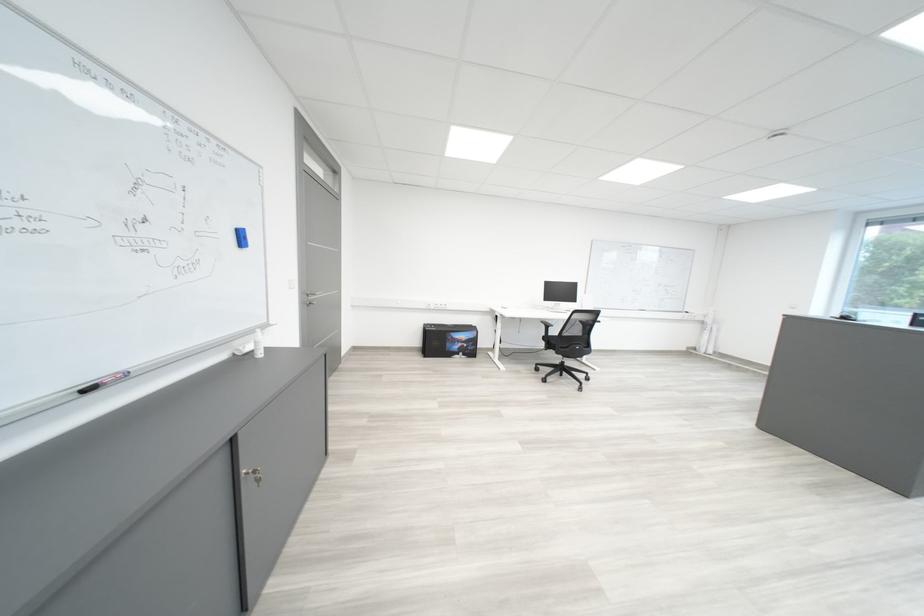
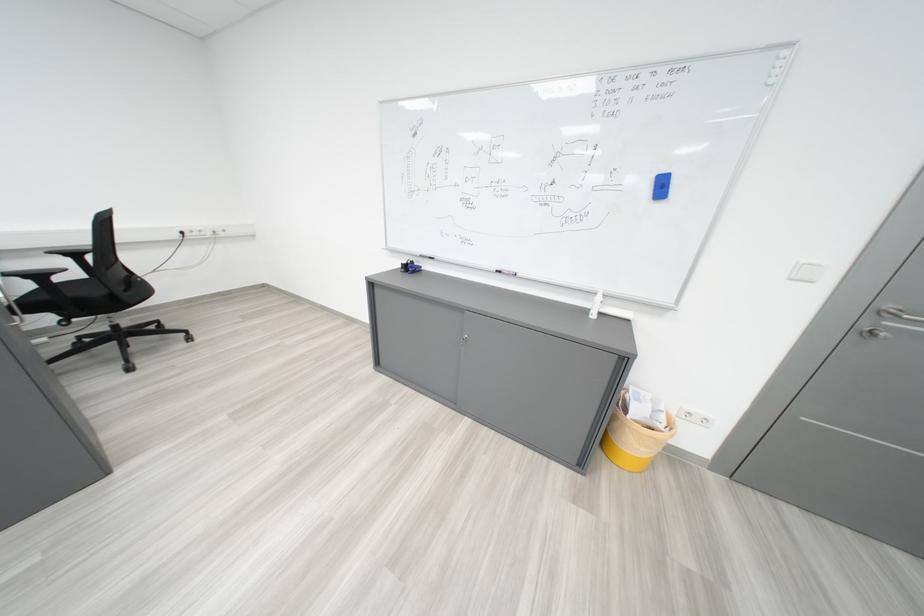
Find the pixel in the second image that matches point (321, 306) in the first image.

(870, 333)